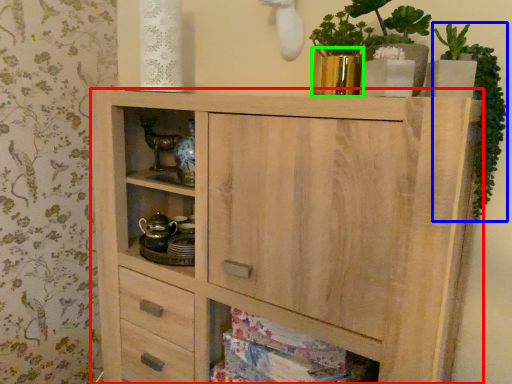
Question: Estimate the real-world distances between objects in this image. Which object is closer to chest of drawers (highlighted by a red box), plant (highlighted by a blue box) or glass vase (highlighted by a green box)?

Choices:
 (A) plant
 (B) glass vase

Answer: (B)